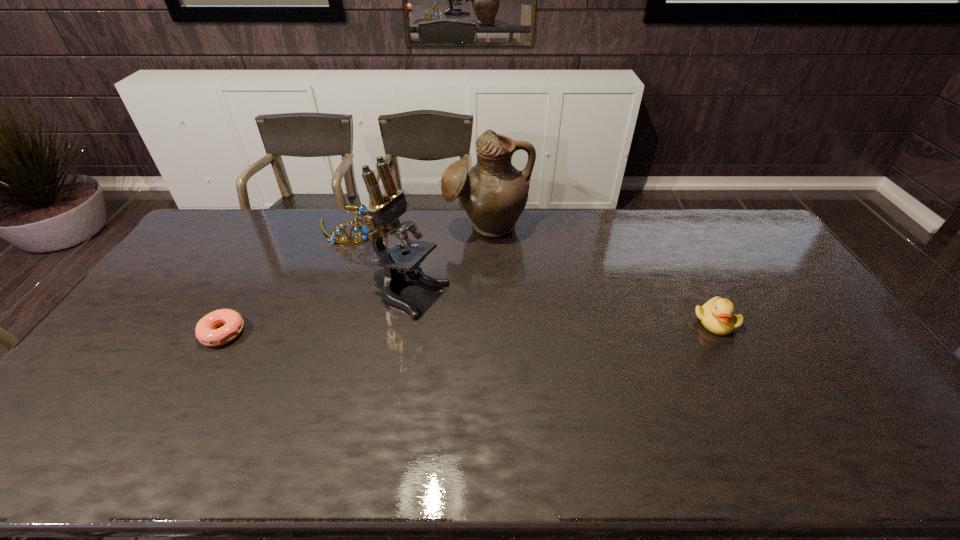
Where is `pitcher that is at the far edge`? pitcher that is at the far edge is located at coordinates (494, 193).

In the image, there is a desktop. Where is `free space at the far edge`? This screenshot has width=960, height=540. free space at the far edge is located at coordinates (451, 234).

In order to click on vacant space at the near edge in this screenshot , I will do `click(286, 402)`.

In the image, there is a desktop. Identify the location of free space at the left edge. (146, 323).

This screenshot has height=540, width=960. Find the location of `free space at the right edge of the desktop`. free space at the right edge of the desktop is located at coordinates (782, 298).

Find the location of a particular element. This screenshot has height=540, width=960. free region at the far left corner of the desktop is located at coordinates (227, 232).

The height and width of the screenshot is (540, 960). In the image, there is a desktop. In order to click on vacant space at the far right corner in this screenshot , I will do tap(753, 227).

In the image, there is a desktop. What are the coordinates of `vacant region at the near right corner` in the screenshot? It's located at (896, 415).

Find the location of `unoccupied position between the microscope and the leftmost object`. unoccupied position between the microscope and the leftmost object is located at coordinates (316, 314).

Find the location of a particular element. free spot between the tiara and the second tallest object is located at coordinates coord(420,226).